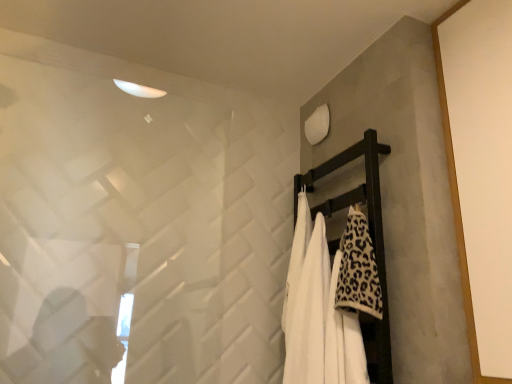
Describe the element at coordinates (358, 269) in the screenshot. I see `leopard print towel at right` at that location.

This screenshot has height=384, width=512. What are the coordinates of `leopard print towel at right` in the screenshot? It's located at (358, 269).

Measure the distance between leopard print towel at right and camera.

1.17 meters.

This screenshot has width=512, height=384. Find the location of `leopard print towel at right`. leopard print towel at right is located at coordinates (358, 269).